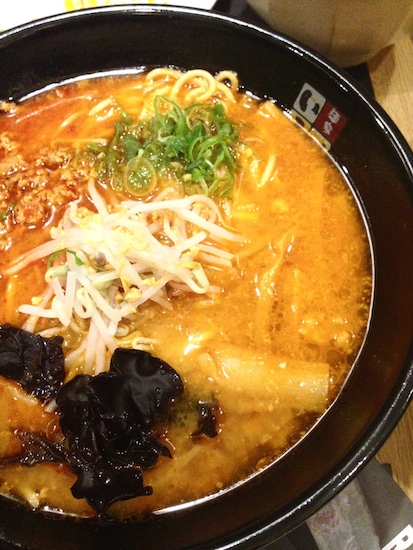
This screenshot has width=413, height=550. I want to click on white plate, so click(12, 4), click(198, 2).